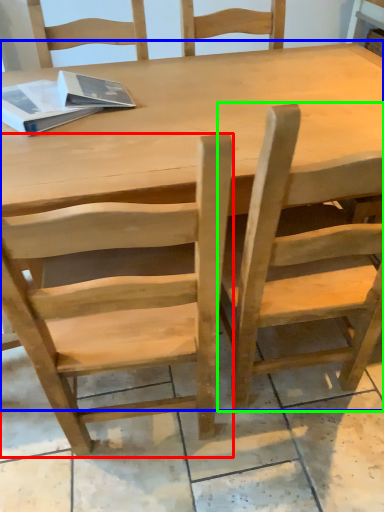
Question: Estimate the real-world distances between objects in this image. Which object is farther from chair (highlighted by a red box), table (highlighted by a blue box) or chair (highlighted by a green box)?

Choices:
 (A) table
 (B) chair

Answer: (A)